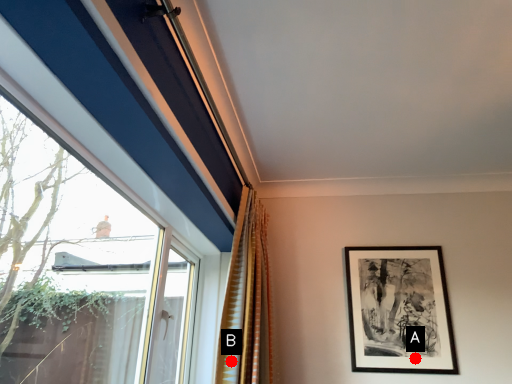
Question: Two points are circled on the image, labeled by A and B beside each circle. Which point is farther to the camera?

Choices:
 (A) A is further
 (B) B is further

Answer: (A)